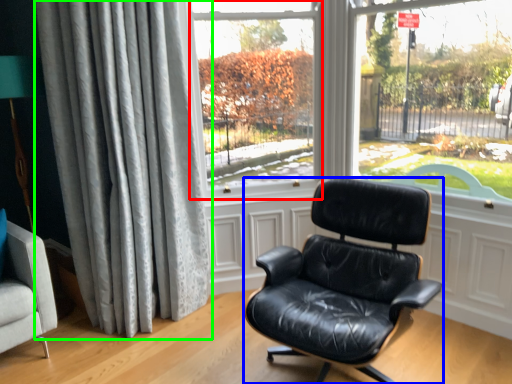
Question: Based on their relative distances, which object is nearer to window screen (highlighted by a red box)? Choose from chair (highlighted by a blue box) and curtain (highlighted by a green box).

Choices:
 (A) chair
 (B) curtain

Answer: (B)